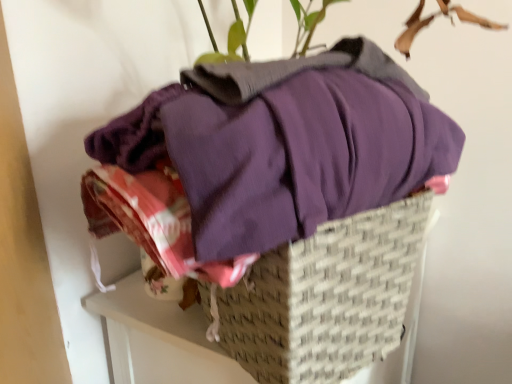
Question: Is purple cotton shirt at center inside or outside of green leafy plant at upper center?

Choices:
 (A) inside
 (B) outside

Answer: (B)

Question: From the image's perspective, relative to green leafy plant at upper center, is purple cotton shirt at center above or below?

Choices:
 (A) below
 (B) above

Answer: (A)

Question: Estimate the real-world distances between objects in this image. Which object is farther from the purple cotton shirt at center?

Choices:
 (A) woven beige basket at center
 (B) green leafy plant at upper center

Answer: (B)

Question: Which object is the farthest from the green leafy plant at upper center?

Choices:
 (A) purple cotton shirt at center
 (B) woven beige basket at center

Answer: (B)